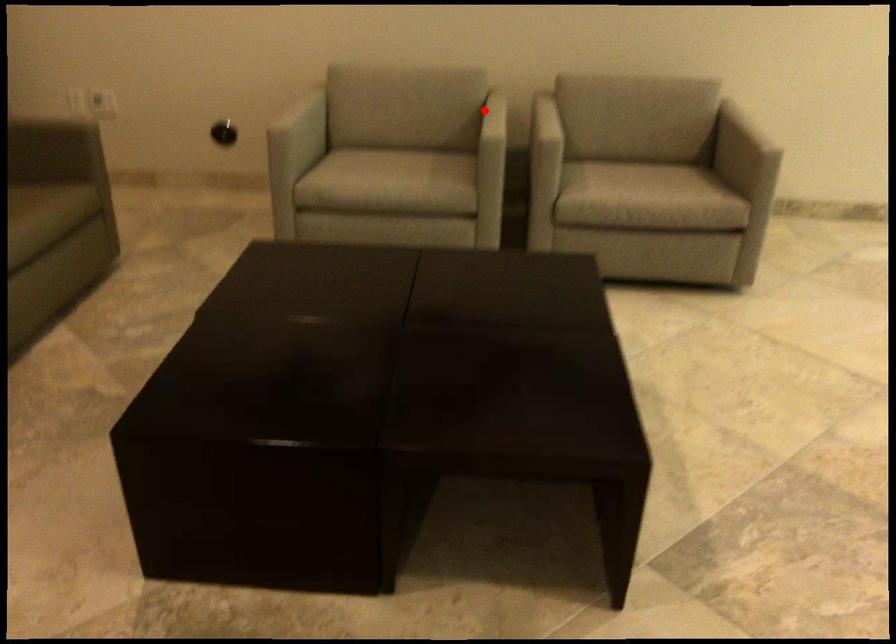
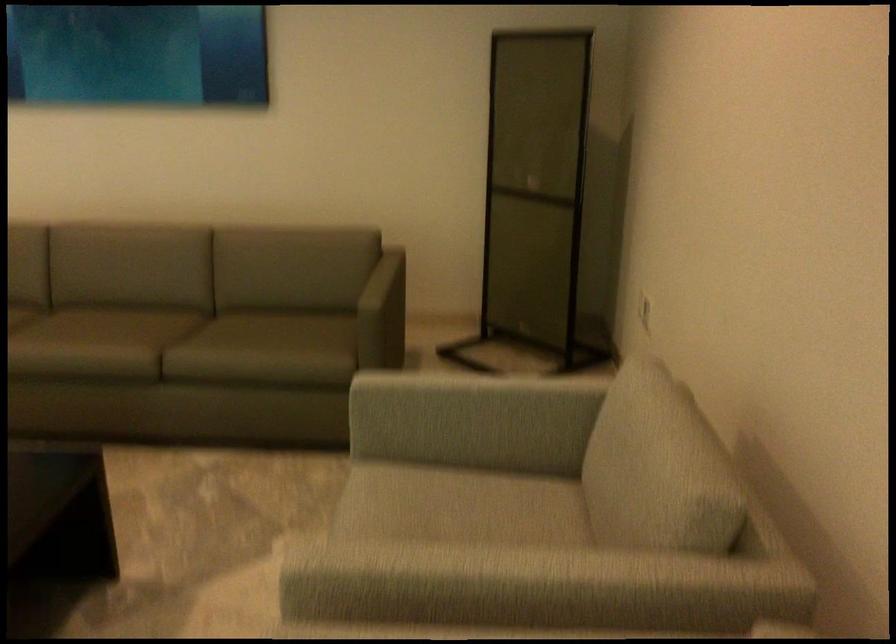
Where in the second image is the point corresponding to the highlighted location from the first image?

(479, 573)